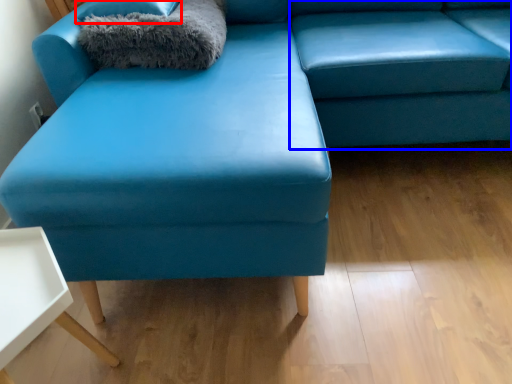
Question: Among these objects, which one is nearest to the camera, pillow (highlighted by a red box) or swivel chair (highlighted by a blue box)?

Choices:
 (A) pillow
 (B) swivel chair

Answer: (B)